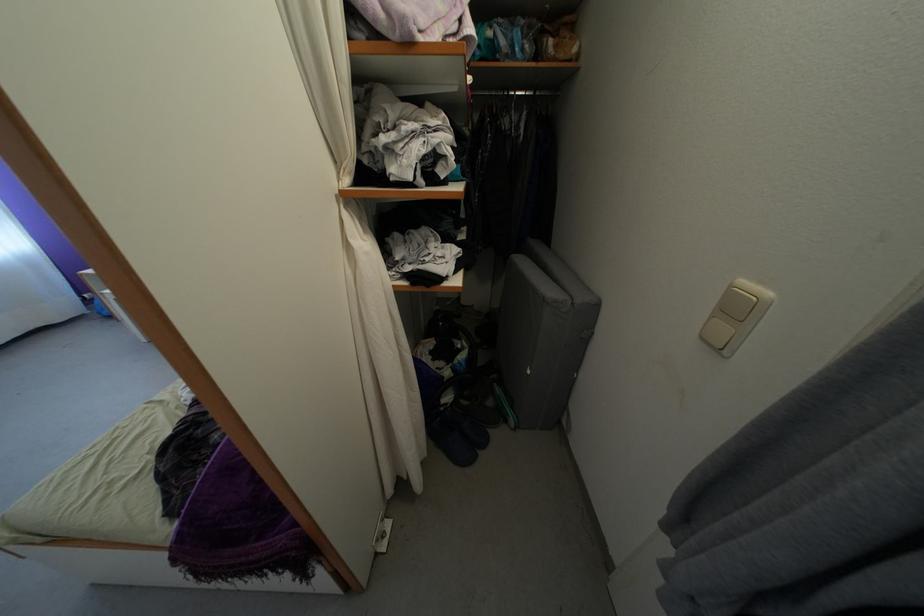
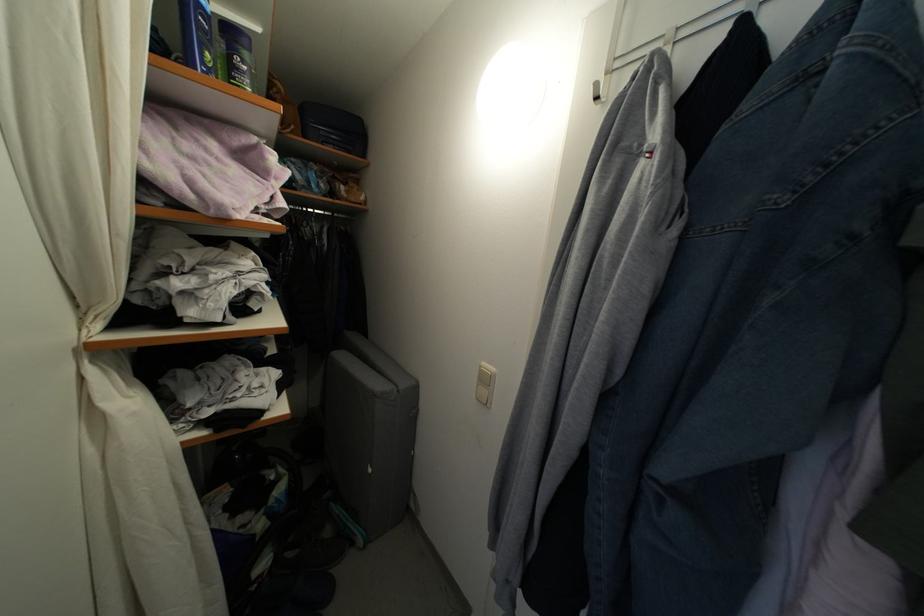
In the second image, find the point that corresponds to pixel 748 286 in the first image.

(489, 370)